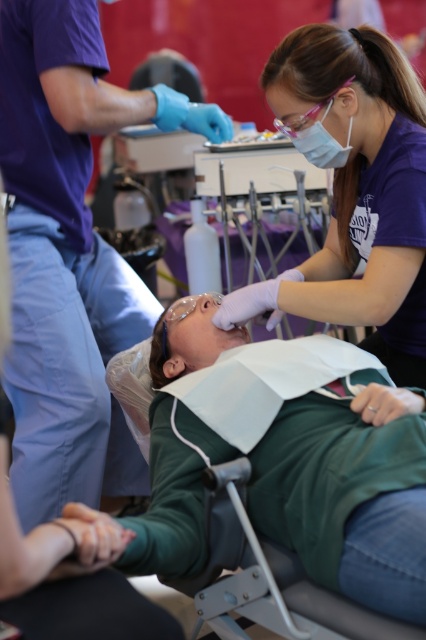
You are a dental assistant observing the scene. The green fabric at center and the matte purple shirt at upper right are both visible in your line of sight. Which object is smaller in size?

The green fabric at center has a smaller size compared to the matte purple shirt at upper right, so the green fabric at center is smaller.

You are a dental assistant who needs to pass a tool to the dentist. The dentist is wearing the matte purple shirt at upper right, and you are standing near the purple smooth shirt at upper center. Can you hand the tool directly without moving closer?

The distance between the matte purple shirt at upper right and the purple smooth shirt at upper center is 27.15 inches. Since the distance is manageable for handing over tools in a dental setting, you can likely pass the tool directly without needing to move closer.